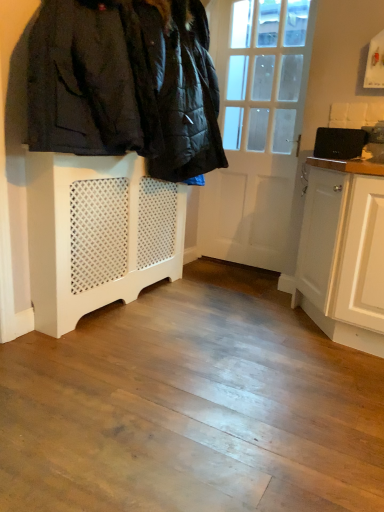
Question: Do you think white wooden door at center is within white lattice radiator at left, or outside of it?

Choices:
 (A) inside
 (B) outside

Answer: (B)

Question: Is white wooden door at center wider or thinner than white lattice radiator at left?

Choices:
 (A) thin
 (B) wide

Answer: (A)

Question: Which object is the closest to the white lattice radiator at left?

Choices:
 (A) white wooden door at center
 (B) white painted wood radiator at lower left
 (C) black matte laptop at upper right

Answer: (B)

Question: Considering the real-world distances, which object is closest to the black matte laptop at upper right?

Choices:
 (A) white wooden door at center
 (B) white painted wood radiator at lower left
 (C) white lattice radiator at left

Answer: (A)